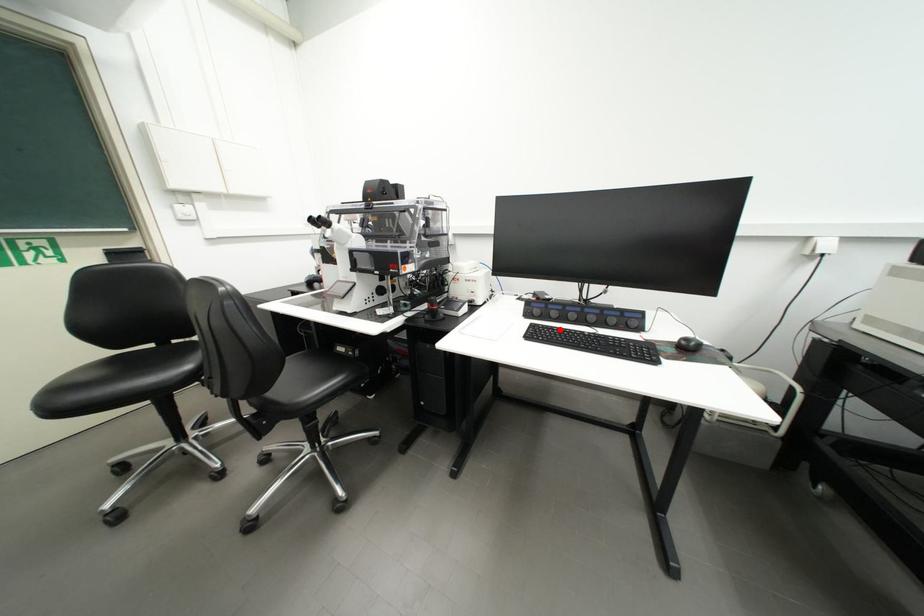
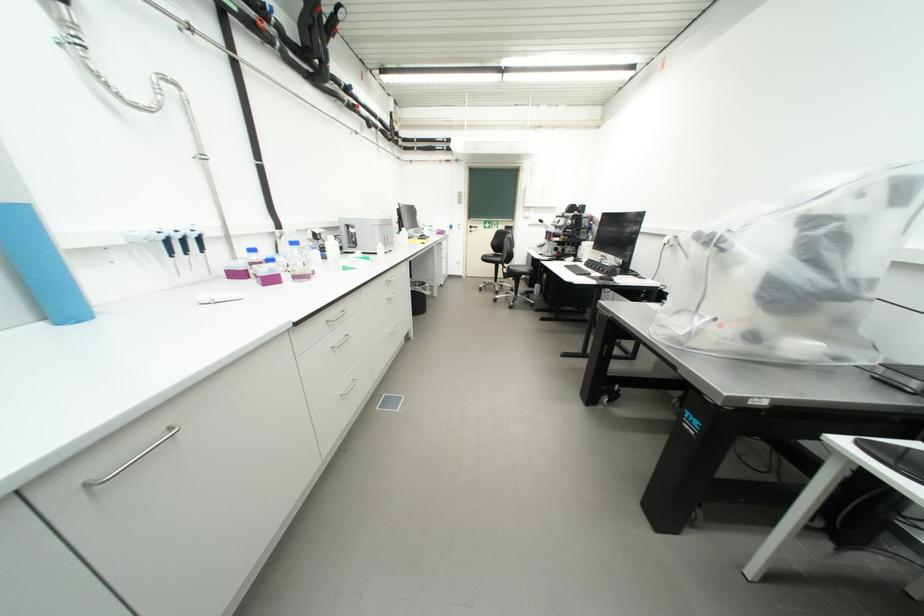
Where in the second image is the point corresponding to the highlighted location from the first image?

(585, 267)